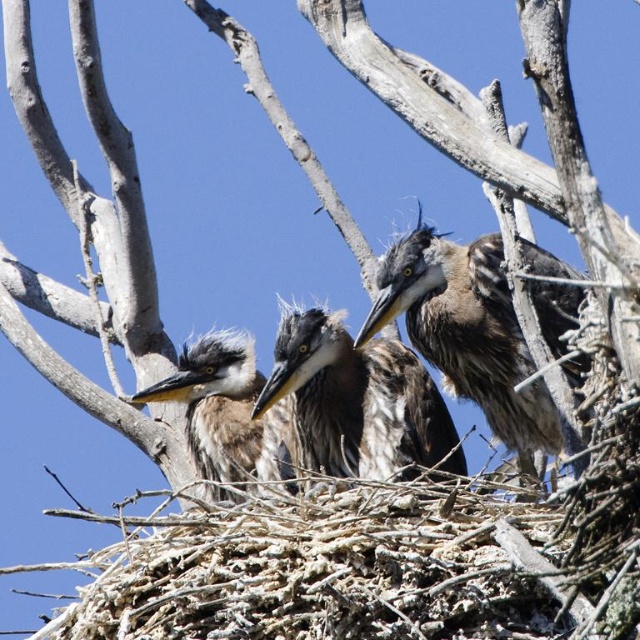
You are a birdwatcher observing the herons in their nest. You notice two points marked in the image. Which point is closer to you, point (378, 438) or point (230, 461)?

Point (378, 438) is in front of point (230, 461), so it is closer to you.

You are a wildlife photographer observing the three young herons in their nest. You notice the gray fluffy heron at center and the gray downy feathers at center. Which of these two has a larger size?

The gray fluffy heron at center has a larger size compared to the gray downy feathers at center.